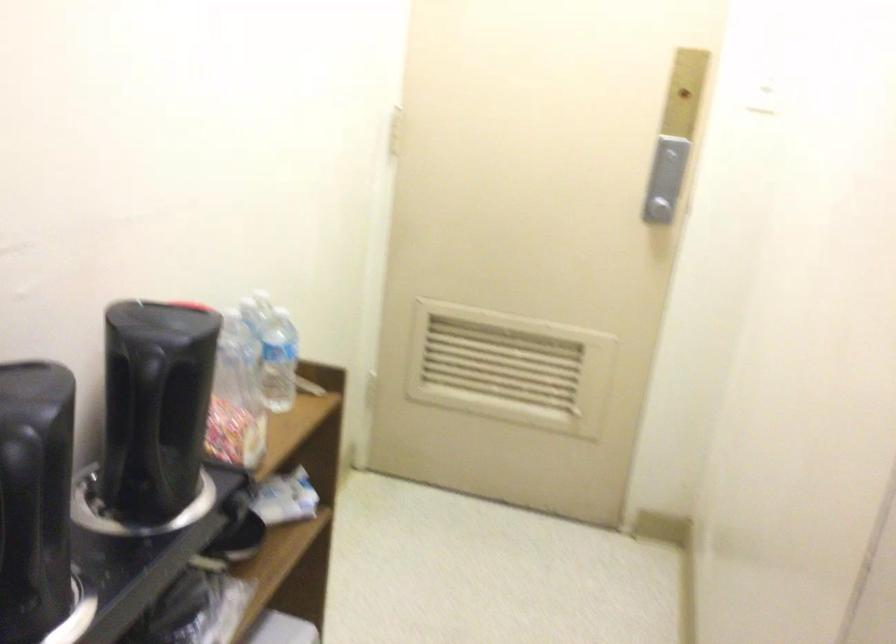
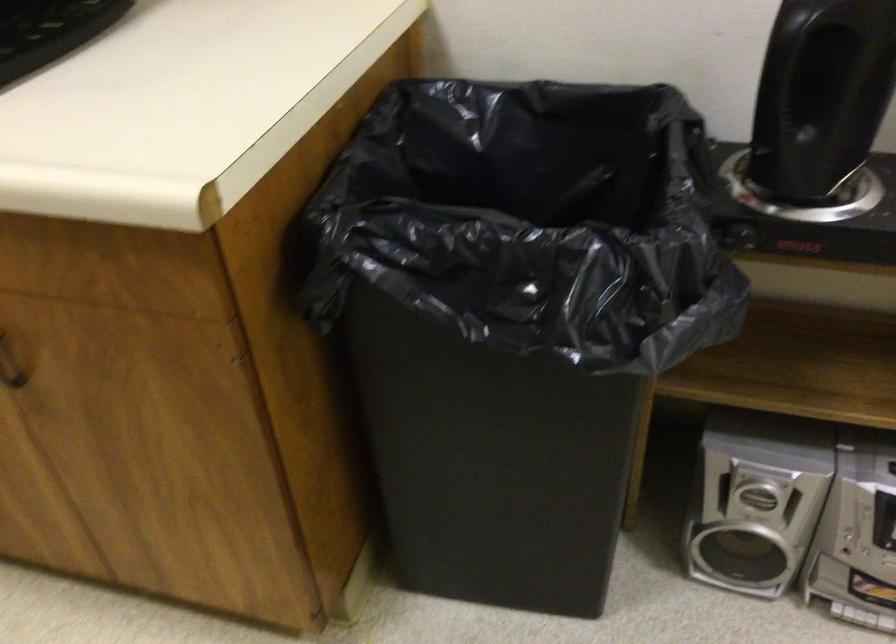
How did the camera likely rotate?

The rotation direction of the camera is left-down.